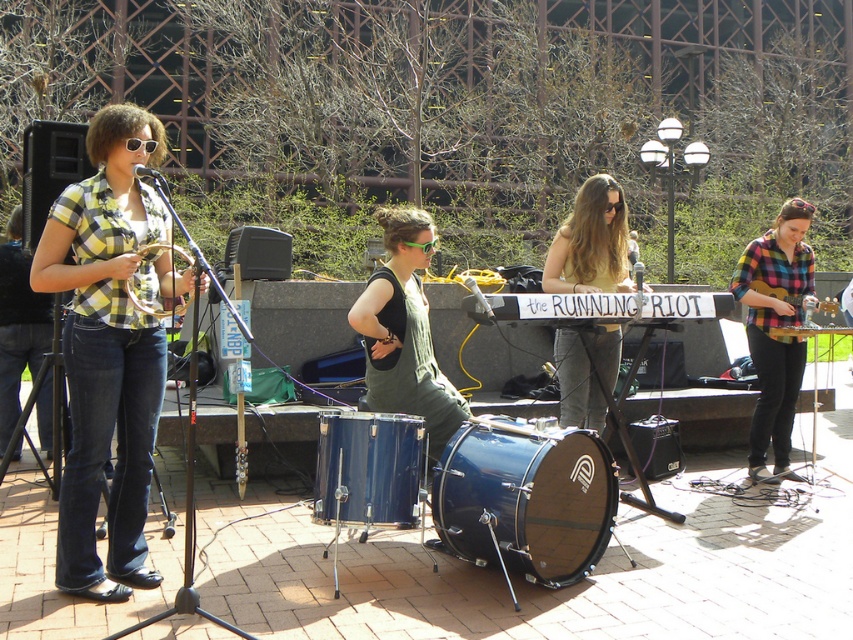
I want to click on blue polished wood drum at center, so click(x=525, y=500).

Between point (579, 513) and point (402, 508), which one is positioned behind?

Point (579, 513)

Does point (492, 445) come in front of point (340, 420)?

Yes, point (492, 445) is in front of point (340, 420).

Find the location of a particular element. The width and height of the screenshot is (853, 640). blue polished wood drum at center is located at coordinates tap(525, 500).

Is checkered fabric shirt at left below blue polished wood drum at center?

Actually, checkered fabric shirt at left is above blue polished wood drum at center.

Identify the location of checkered fabric shirt at left. The width and height of the screenshot is (853, 640). click(109, 348).

The height and width of the screenshot is (640, 853). What are the coordinates of `checkered fabric shirt at left` in the screenshot? It's located at (109, 348).

From the picture: Can you confirm if checkered fabric shirt at left is positioned to the left of metallic silver guitar at center-right?

Correct, you'll find checkered fabric shirt at left to the left of metallic silver guitar at center-right.

Identify the location of checkered fabric shirt at left. The height and width of the screenshot is (640, 853). (109, 348).

The image size is (853, 640). In order to click on checkered fabric shirt at left in this screenshot , I will do `click(109, 348)`.